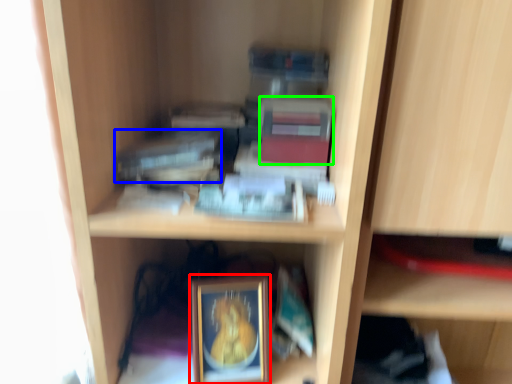
Question: Which object is positioned farthest from picture frame (highlighted by a red box)? Select from paperback book (highlighted by a blue box) and paperback book (highlighted by a green box).

Choices:
 (A) paperback book
 (B) paperback book

Answer: (B)